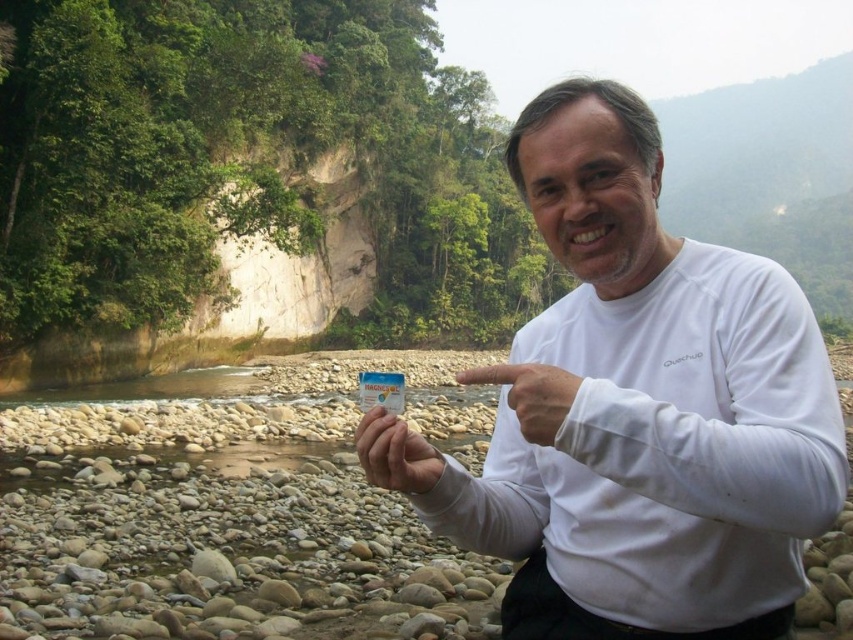
Can you confirm if white matte shirt at center is smaller than white matte hand at center?

No, white matte shirt at center is not smaller than white matte hand at center.

Which is behind, point (590, 364) or point (518, 412)?

Positioned behind is point (590, 364).

You are a GUI agent. You are given a task and a screenshot of the screen. Output one action in this format:
    pyautogui.click(x=<x>, y=<y>)
    Task: Click on the white matte shirt at center
    
    Given the screenshot: What is the action you would take?
    pyautogui.click(x=648, y=408)

Who is lower down, white matte card at center or white matte hand at center?

white matte card at center is below.

Which of these two, white matte card at center or white matte hand at center, stands taller?

white matte hand at center is taller.

What do you see at coordinates (395, 452) in the screenshot? This screenshot has width=853, height=640. I see `white matte card at center` at bounding box center [395, 452].

Where is `white matte card at center`? This screenshot has width=853, height=640. white matte card at center is located at coordinates (395, 452).

From the picture: Can you confirm if white matte shirt at center is bigger than white matte card at center?

Indeed, white matte shirt at center has a larger size compared to white matte card at center.

Who is positioned more to the right, white matte shirt at center or white matte card at center?

Positioned to the right is white matte shirt at center.

Is point (695, 412) less distant than point (381, 416)?

Yes, it is.

Find the location of a particular element. Image resolution: width=853 pixels, height=640 pixels. white matte shirt at center is located at coordinates (648, 408).